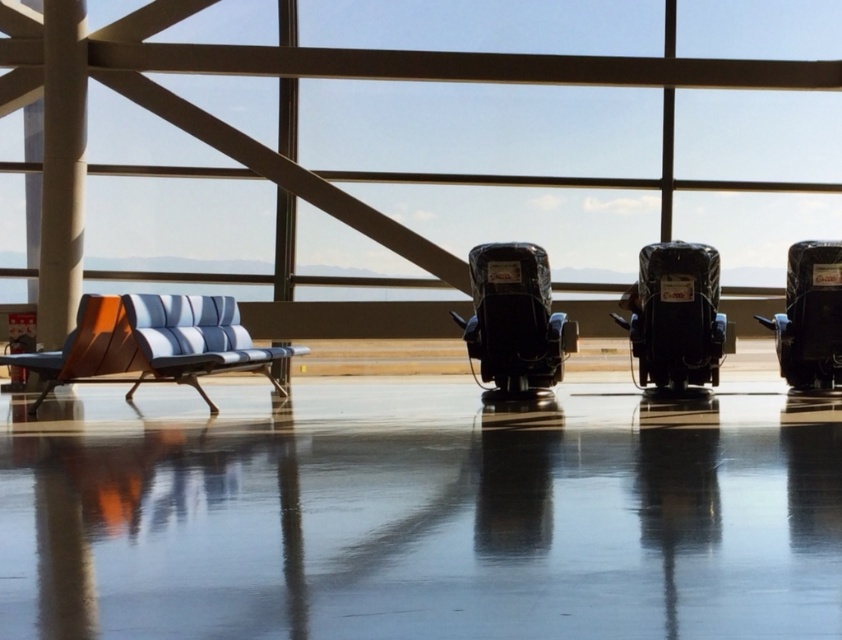
You are a traveler carrying a large suitcase and need to sit down. You see a black plastic baby carriage at center and a matte black beach chair at center. Which object is closer to you, and can you sit on the beach chair without moving the baby carriage?

The black plastic baby carriage at center is in front of the matte black beach chair at center, meaning the baby carriage is closer to you. Since the baby carriage is blocking access to the beach chair, you would need to move it to sit on the chair.

You are a traveler carrying a large suitcase and need to sit between the matte black beach chair at center and the black plastic beach chair at right. Which chair should you choose if you want more space to sit comfortably?

The matte black beach chair at center is wider than the black plastic beach chair at right, so you should choose the matte black beach chair at center for more comfortable seating space.

You are a traveler carrying a large suitcase and need to pass between the black plastic baby carriage at center and the matte black beach chair at center. Can you navigate through the space between them without touching either object? Please provide your reasoning based on the distance between them.

The black plastic baby carriage at center and the matte black beach chair at center are 1.10 meters apart. A standard large suitcase typically measures around 0.6 to 0.7 meters in width. Since the gap between the two objects is 1.10 meters, which is wider than the suitcase, you should be able to pass through the space between them without touching either object.